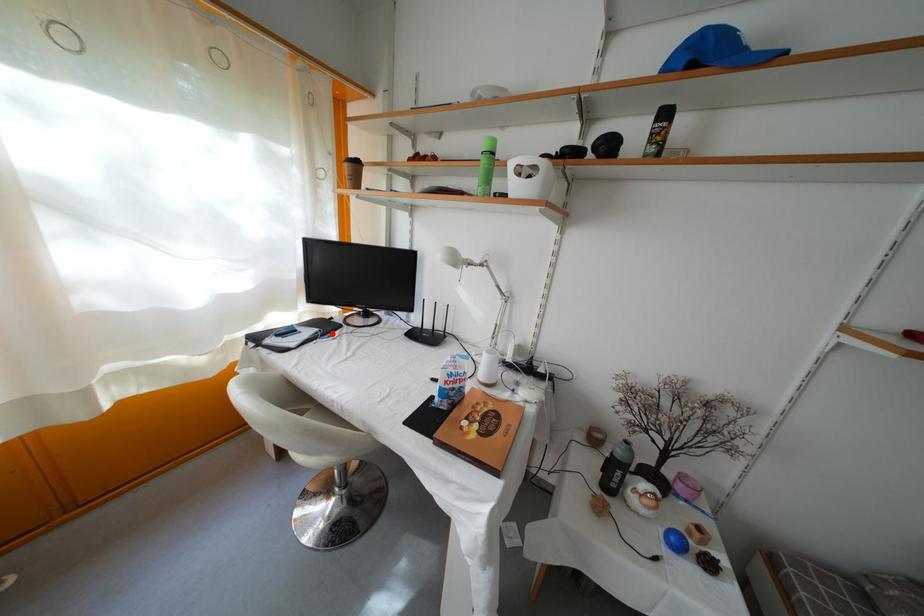
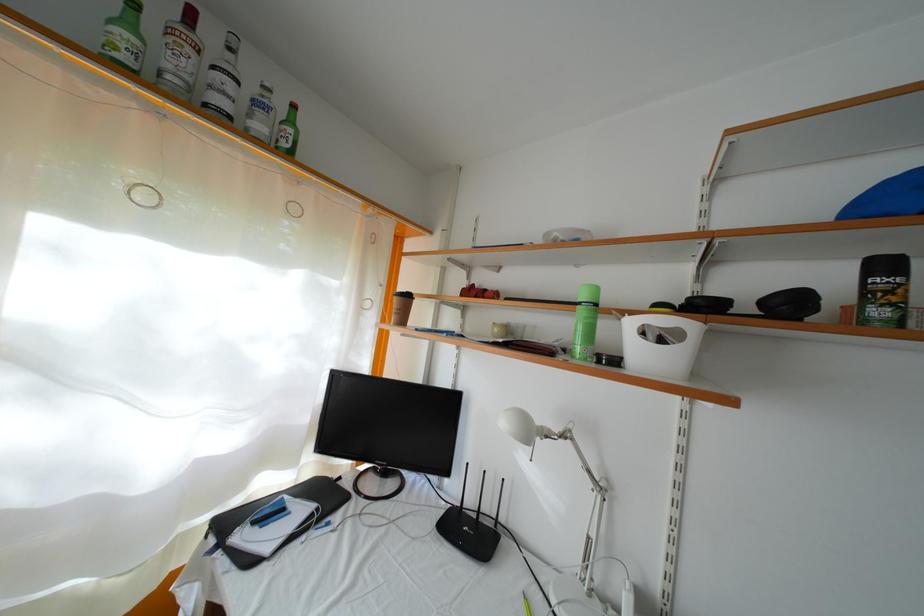
Where in the second image is the point corresponding to the highlighted location from the first image?

(334, 506)